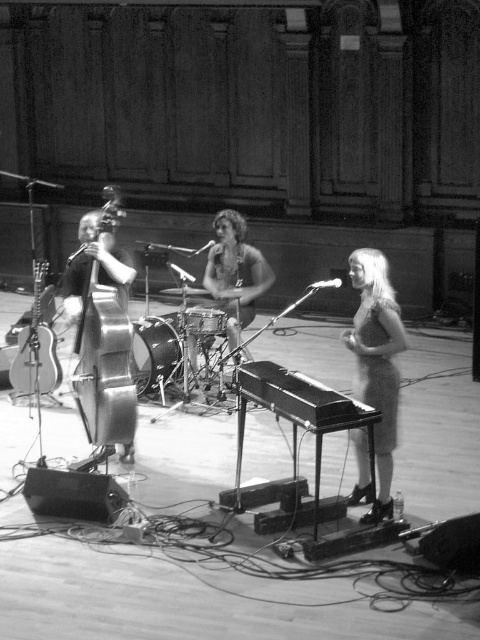
Question: Which of these objects is positioned closest to the acoustic wood guitar at left?

Choices:
 (A) satin dress at center
 (B) shiny silver cello at center-left
 (C) shiny brown drum set at center

Answer: (B)

Question: Is shiny silver cello at center-left positioned before acoustic wood guitar at left?

Choices:
 (A) yes
 (B) no

Answer: (A)

Question: Estimate the real-world distances between objects in this image. Which object is farther from the shiny silver cello at center-left?

Choices:
 (A) shiny brown drum set at center
 (B) satin dress at center

Answer: (B)

Question: Which is nearer to the shiny silver cello at center-left?

Choices:
 (A) satin dress at center
 (B) shiny brown drum set at center

Answer: (B)

Question: From the image, what is the correct spatial relationship of shiny silver cello at center-left in relation to acoustic wood guitar at left?

Choices:
 (A) left
 (B) right

Answer: (B)

Question: Considering the relative positions of shiny silver cello at center-left and acoustic wood guitar at left in the image provided, where is shiny silver cello at center-left located with respect to acoustic wood guitar at left?

Choices:
 (A) above
 (B) below

Answer: (A)